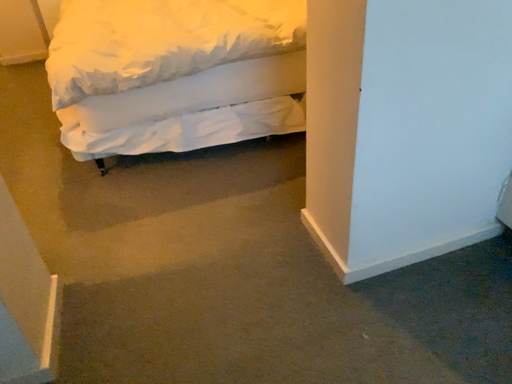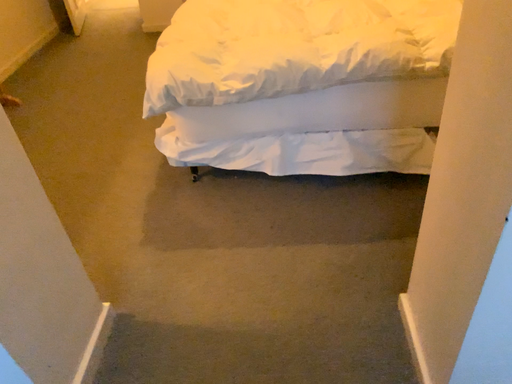
Question: Which way did the camera rotate in the video?

Choices:
 (A) rotated left
 (B) rotated right

Answer: (A)